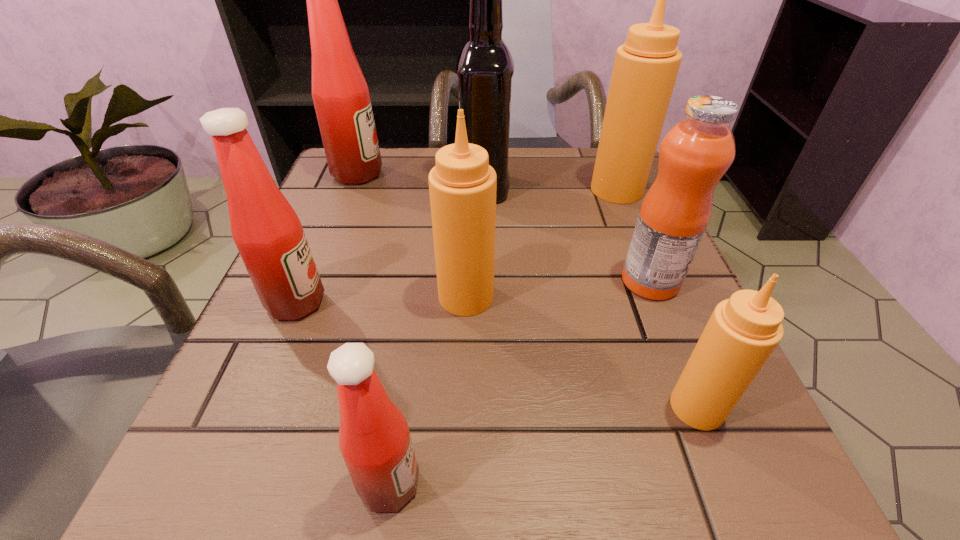
The image size is (960, 540). What are the coordinates of `vacant space located on the front-facing side of the rightmost red condiment` in the screenshot? It's located at (492, 484).

Where is `liquor present at the far edge`? The image size is (960, 540). liquor present at the far edge is located at coordinates (485, 67).

Identify the location of object that is at the near edge. (374, 439).

Where is `fruit juice at the right edge`? fruit juice at the right edge is located at coordinates (696, 152).

At what (x,y) coordinates should I click in order to perform the action: click on object situated at the far left corner. Please return your answer as a coordinate pair (x, y). The height and width of the screenshot is (540, 960). Looking at the image, I should click on (341, 97).

What are the coordinates of `object that is at the far right corner` in the screenshot? It's located at (646, 66).

Identify the location of vacant space at the near edge of the desktop. Image resolution: width=960 pixels, height=540 pixels. (317, 521).

Where is `free spot at the left edge of the desktop`? The width and height of the screenshot is (960, 540). free spot at the left edge of the desktop is located at coordinates (331, 293).

You are a GUI agent. You are given a task and a screenshot of the screen. Output one action in this format:
    pyautogui.click(x=<x>, y=<y>)
    Task: Click on the free space at the right edge
    This screenshot has width=960, height=540.
    Given the screenshot: What is the action you would take?
    pyautogui.click(x=627, y=353)

This screenshot has height=540, width=960. In order to click on vacant space at the far left corner of the desktop in this screenshot , I will do `click(374, 194)`.